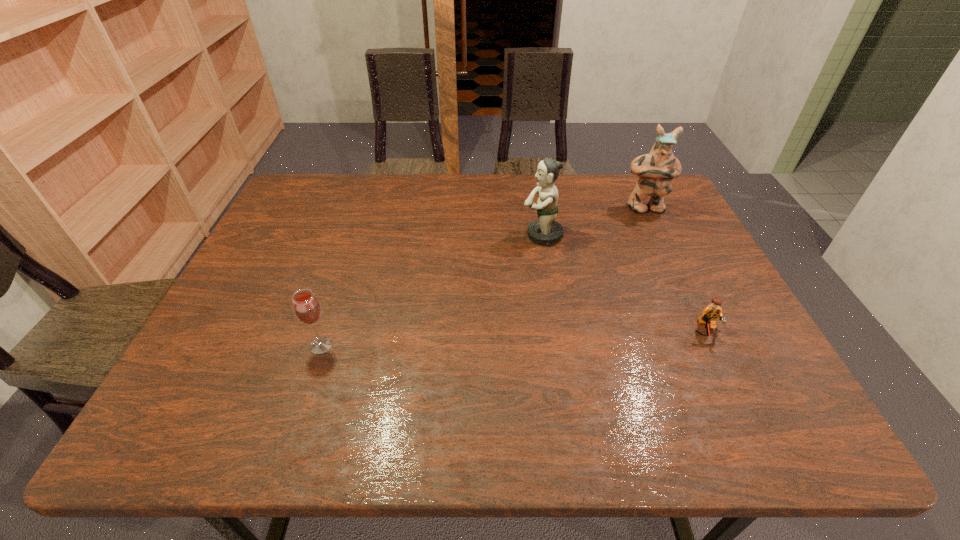
Identify the location of the farther figurine. Image resolution: width=960 pixels, height=540 pixels. (655, 170).

Locate an element on the screen. the farthest object is located at coordinates (655, 170).

Locate an element on the screen. the second farthest object is located at coordinates (545, 231).

In order to click on the left figurine in this screenshot , I will do `click(545, 231)`.

The image size is (960, 540). Find the location of `the third tallest object`. the third tallest object is located at coordinates click(306, 306).

This screenshot has width=960, height=540. Identify the location of wineglass. (306, 306).

This screenshot has height=540, width=960. Identify the location of Lego. (709, 315).

Locate an element on the screen. This screenshot has height=540, width=960. vacant space located on the front-facing side of the farthest object is located at coordinates point(692,309).

I want to click on vacant space located on the front-facing side of the second object from left to right, so click(x=444, y=235).

Identify the location of vacant space situated 0.130m on the front-facing side of the second object from left to right. The height and width of the screenshot is (540, 960). coord(475,235).